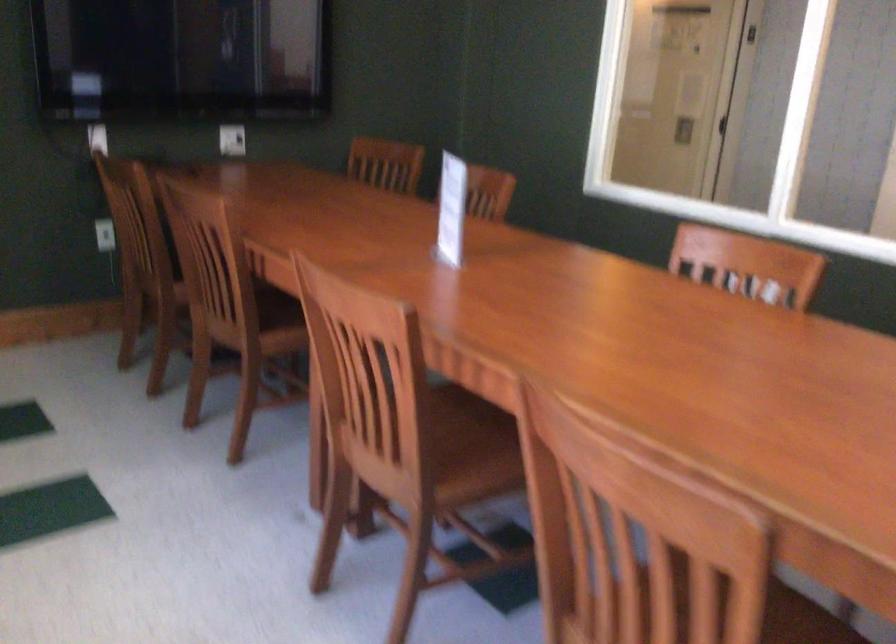
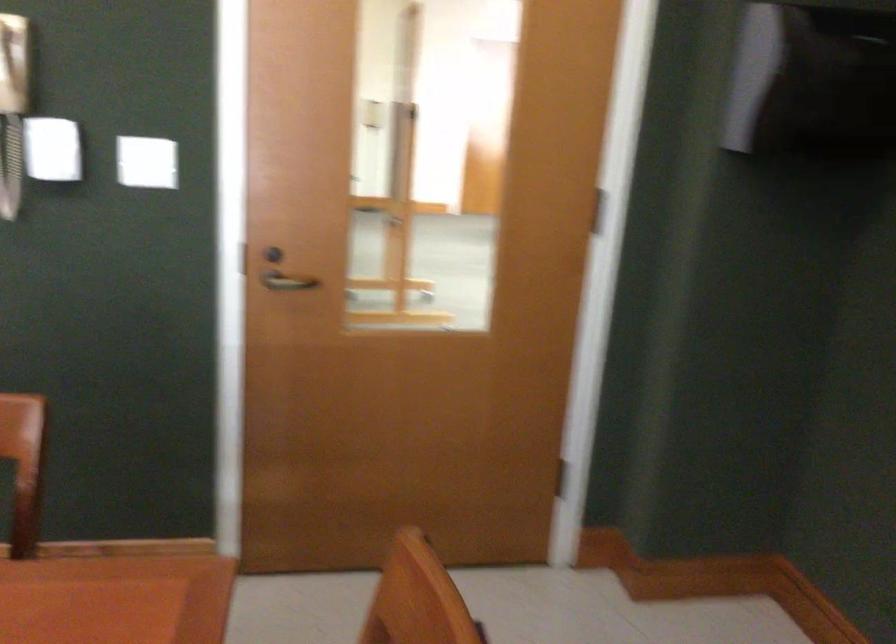
Question: The camera is either moving clockwise (left) or counter-clockwise (right) around the object. The first image is from the beginning of the video and the second image is from the end. Is the camera moving left or right when shooting the video?

Choices:
 (A) Left
 (B) Right

Answer: (A)